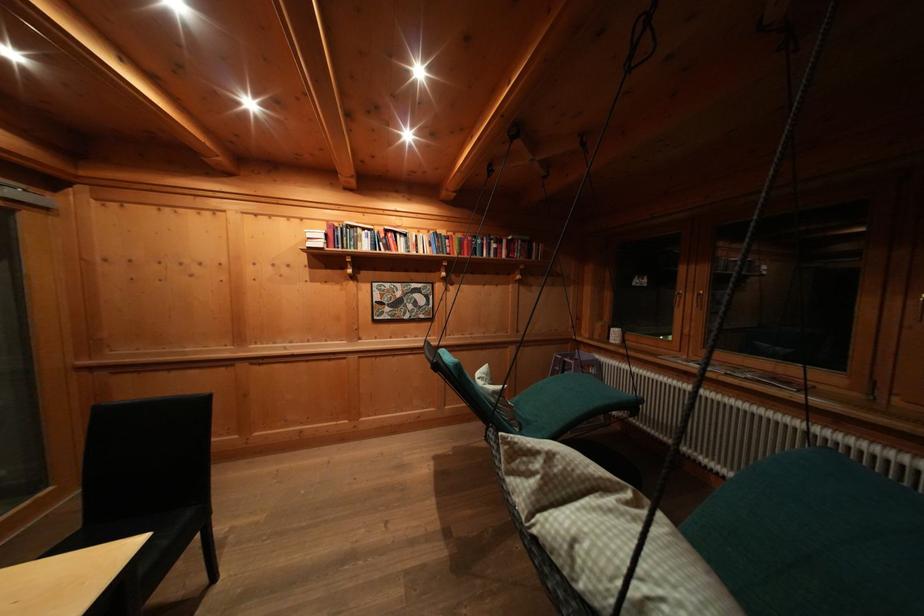
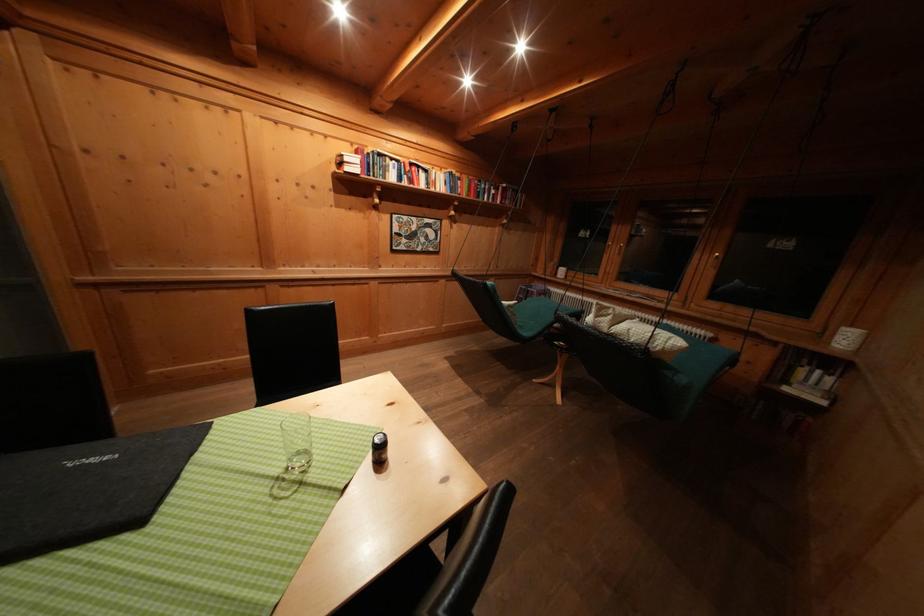
Where in the second image is the point corresponding to [529,524] from the first image?

(612, 334)